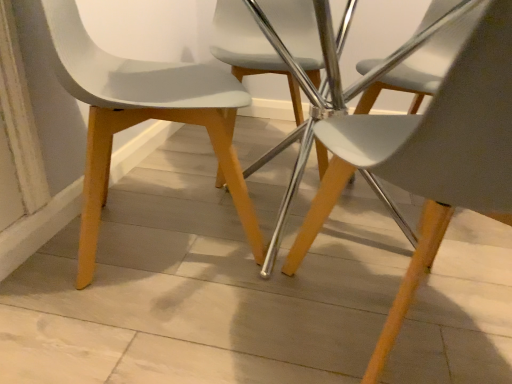
Question: From the image's perspective, is white matte plastic chair at center, the 1th chair in the front-to-back sequence, positioned above or below matte white chair at left, placed as the second chair when sorted from back to front?

Choices:
 (A) above
 (B) below

Answer: (B)

Question: Choose the correct answer: Is white matte plastic chair at center, the 3th chair when ordered from back to front, inside matte white chair at left, placed as the second chair when sorted from back to front, or outside it?

Choices:
 (A) inside
 (B) outside

Answer: (B)

Question: Based on their relative distances, which object is farther from the matte white chair at center, the 3th chair when ordered from front to back?

Choices:
 (A) matte white chair at left, arranged as the second chair when viewed from the front
 (B) white matte plastic chair at center, the 1th chair in the front-to-back sequence

Answer: (B)

Question: Estimate the real-world distances between objects in this image. Which object is closer to the matte white chair at left, placed as the second chair when sorted from back to front?

Choices:
 (A) white matte plastic chair at center, the 1th chair in the front-to-back sequence
 (B) matte white chair at center, which is the 1th chair in back-to-front order

Answer: (A)